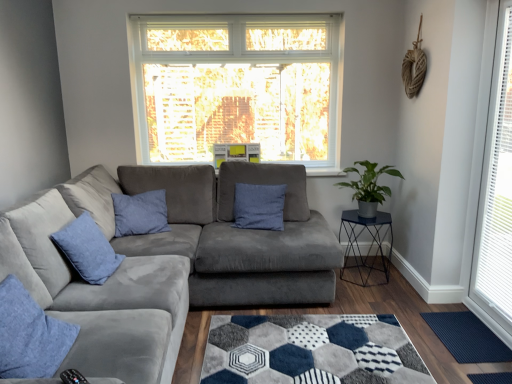
Question: Is metallic blue cocktail table at right behind blue velvet pillow at left, acting as the 2th pillow starting from the back?

Choices:
 (A) yes
 (B) no

Answer: (A)

Question: From a real-world perspective, is metallic blue cocktail table at right on top of blue velvet pillow at left, the 1th pillow positioned from the left?

Choices:
 (A) yes
 (B) no

Answer: (B)

Question: From the image's perspective, does metallic blue cocktail table at right appear higher than blue velvet pillow at left, acting as the 2th pillow starting from the back?

Choices:
 (A) yes
 (B) no

Answer: (B)

Question: Is the surface of metallic blue cocktail table at right in direct contact with blue velvet pillow at left, acting as the 2th pillow starting from the front?

Choices:
 (A) yes
 (B) no

Answer: (B)

Question: Does metallic blue cocktail table at right have a lesser height compared to blue velvet pillow at left, the 3th pillow when ordered from right to left?

Choices:
 (A) no
 (B) yes

Answer: (A)

Question: Is metallic blue cocktail table at right facing towards blue velvet pillow at left, acting as the 2th pillow starting from the front?

Choices:
 (A) yes
 (B) no

Answer: (B)

Question: Is blue cotton pillow at center, arranged as the third pillow when viewed from the front, oriented towards dark blue rubber mat at lower right?

Choices:
 (A) no
 (B) yes

Answer: (A)

Question: Can you confirm if blue cotton pillow at center, arranged as the third pillow when viewed from the front, is wider than dark blue rubber mat at lower right?

Choices:
 (A) no
 (B) yes

Answer: (A)

Question: Does blue cotton pillow at center, the third pillow in the left-to-right sequence, lie behind dark blue rubber mat at lower right?

Choices:
 (A) no
 (B) yes

Answer: (B)

Question: Considering the relative positions of blue cotton pillow at center, the third pillow in the left-to-right sequence, and dark blue rubber mat at lower right in the image provided, is blue cotton pillow at center, the third pillow in the left-to-right sequence, in front of dark blue rubber mat at lower right?

Choices:
 (A) no
 (B) yes

Answer: (A)

Question: From the image's perspective, would you say blue cotton pillow at center, the third pillow in the left-to-right sequence, is shown under dark blue rubber mat at lower right?

Choices:
 (A) yes
 (B) no

Answer: (B)

Question: From a real-world perspective, is blue cotton pillow at center, arranged as the first pillow when viewed from the back, positioned over dark blue rubber mat at lower right based on gravity?

Choices:
 (A) no
 (B) yes

Answer: (B)

Question: Is blue velvet pillow at left, acting as the 2th pillow starting from the back, positioned with its back to green matte plant at right?

Choices:
 (A) yes
 (B) no

Answer: (B)